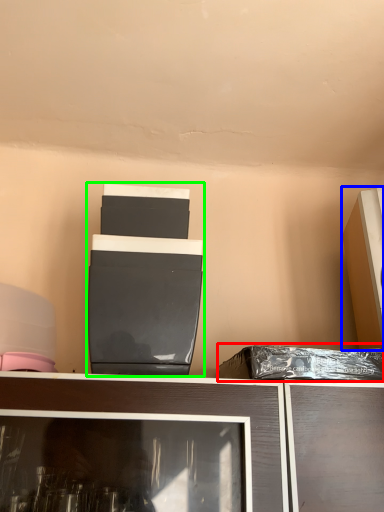
Question: Which object is the farthest from garbage (highlighted by a red box)? Choose among these: appliance (highlighted by a blue box) or appliance (highlighted by a green box).

Choices:
 (A) appliance
 (B) appliance

Answer: (B)